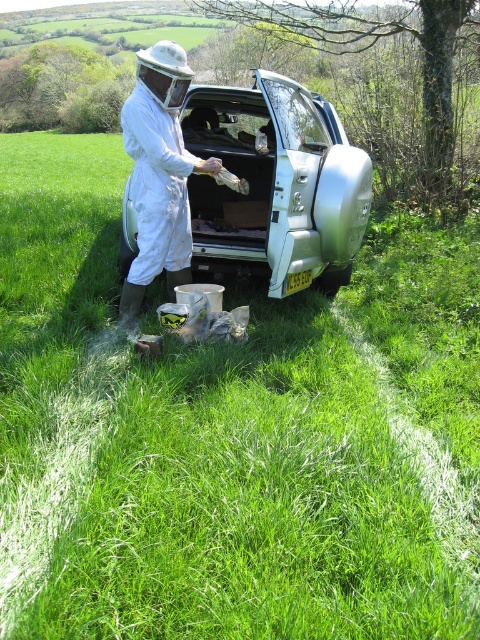
You are a delivery driver who needs to deliver a package to the person at point (158, 176). The package is too large to carry through the grass. Which vehicle can you use to reach them?

The silver SUV with its rear doors open is the vehicle you can use to reach the person at point (158, 176) since it is positioned near them and has an open door, allowing access to the package inside.

You are a photographer positioned at the scene. You want to take a photo that includes both the silver metallic car at center and the white fabric beekeeper suit at center. Which object should you adjust your camera angle to focus on first to ensure both are in frame?

The silver metallic car at center is further away than the white fabric beekeeper suit at center, so you should focus on the silver metallic car at center first to ensure it is in frame along with the closer object.